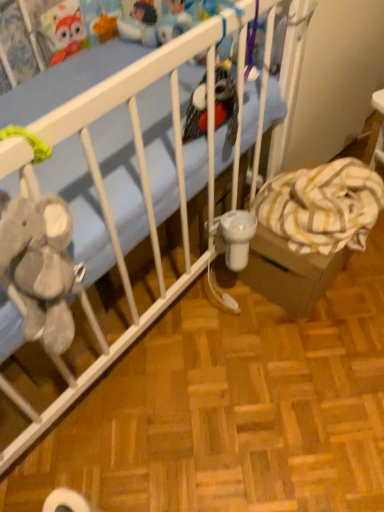
Question: From a real-world perspective, is blue fabric crib at upper left located beneath velvety plush bird at center, which ranks as the 2th toy in back-to-front order?

Choices:
 (A) yes
 (B) no

Answer: (A)

Question: Considering the relative sizes of blue fabric crib at upper left and velvety plush bird at center, the second toy from the left, in the image provided, is blue fabric crib at upper left smaller than velvety plush bird at center, the second toy from the left,?

Choices:
 (A) yes
 (B) no

Answer: (B)

Question: Would you say blue fabric crib at upper left is a long distance from velvety plush bird at center, acting as the 1th toy starting from the front?

Choices:
 (A) yes
 (B) no

Answer: (B)

Question: Is blue fabric crib at upper left oriented away from velvety plush bird at center, the 2th toy viewed from the top?

Choices:
 (A) yes
 (B) no

Answer: (B)

Question: Is blue fabric crib at upper left positioned before velvety plush bird at center, acting as the 1th toy starting from the front?

Choices:
 (A) no
 (B) yes

Answer: (B)

Question: Is blue fabric crib at upper left inside the boundaries of matte plastic toy at upper center, acting as the second toy starting from the right, or outside?

Choices:
 (A) outside
 (B) inside

Answer: (A)

Question: Considering the positions of blue fabric crib at upper left and matte plastic toy at upper center, which is the second toy in bottom-to-top order, in the image, is blue fabric crib at upper left taller or shorter than matte plastic toy at upper center, which is the second toy in bottom-to-top order,?

Choices:
 (A) short
 (B) tall

Answer: (A)

Question: Does point (241, 24) appear closer or farther from the camera than point (119, 25)?

Choices:
 (A) closer
 (B) farther

Answer: (A)

Question: Looking at their shapes, would you say blue fabric crib at upper left is wider or thinner than matte plastic toy at upper center, arranged as the first toy when viewed from the back?

Choices:
 (A) thin
 (B) wide

Answer: (B)

Question: Considering the positions of velvety plush bird at center, which is the 1th toy from bottom to top, and matte plastic toy at upper center, which is the second toy in bottom-to-top order, in the image, is velvety plush bird at center, which is the 1th toy from bottom to top, taller or shorter than matte plastic toy at upper center, which is the second toy in bottom-to-top order,?

Choices:
 (A) short
 (B) tall

Answer: (B)

Question: Is point (226, 106) closer or farther from the camera than point (137, 18)?

Choices:
 (A) farther
 (B) closer

Answer: (B)

Question: Looking at the image, does velvety plush bird at center, the 2th toy viewed from the top, seem bigger or smaller compared to matte plastic toy at upper center, which is the second toy in bottom-to-top order?

Choices:
 (A) small
 (B) big

Answer: (B)

Question: Choose the correct answer: Is velvety plush bird at center, which ranks as the 2th toy in back-to-front order, inside matte plastic toy at upper center, arranged as the first toy when viewed from the back, or outside it?

Choices:
 (A) inside
 (B) outside

Answer: (B)

Question: Considering the positions of striped fabric cardboard box at lower right and matte plastic toy at upper center, acting as the second toy starting from the right, in the image, is striped fabric cardboard box at lower right taller or shorter than matte plastic toy at upper center, acting as the second toy starting from the right,?

Choices:
 (A) short
 (B) tall

Answer: (B)

Question: Relative to matte plastic toy at upper center, arranged as the first toy when viewed from the back, is striped fabric cardboard box at lower right in front or behind?

Choices:
 (A) front
 (B) behind

Answer: (A)